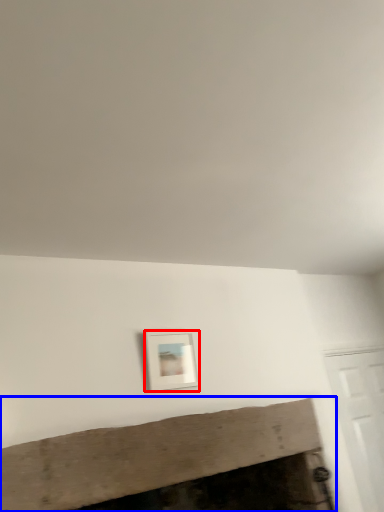
Question: Which point is further to the camera, picture frame (highlighted by a red box) or fireplace (highlighted by a blue box)?

Choices:
 (A) picture frame
 (B) fireplace

Answer: (A)